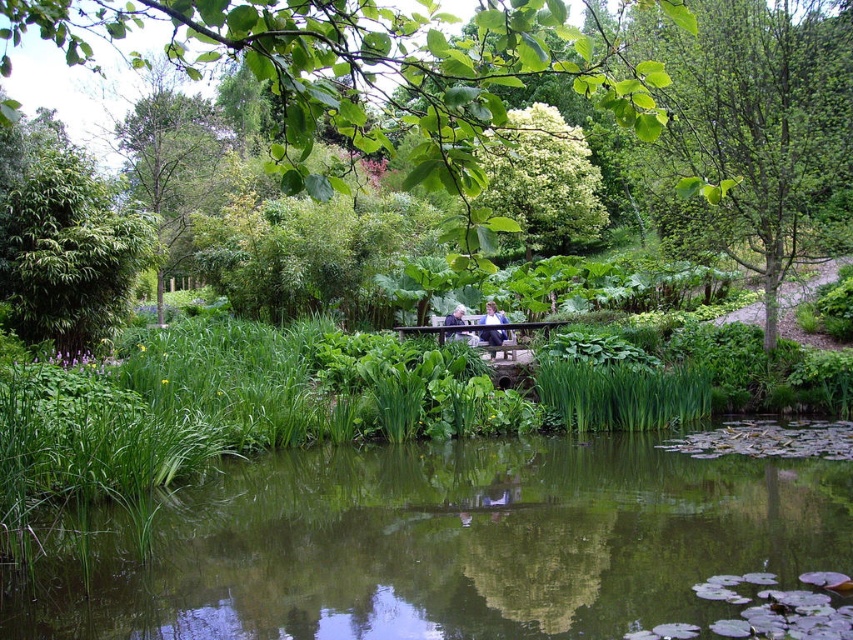
Who is shorter, green leafy tree at center or light blue fabric at center?

light blue fabric at center is shorter.

Is point (679, 99) positioned before point (451, 316)?

Yes, point (679, 99) is in front of point (451, 316).

Find the location of `green leafy tree at center`. green leafy tree at center is located at coordinates (757, 129).

Between green leafy tree at upper center and blue denim jacket at center, which one is positioned lower?

blue denim jacket at center is below.

Does point (538, 8) come closer to viewer compared to point (503, 339)?

That is True.

The image size is (853, 640). What are the coordinates of `green leafy tree at upper center` in the screenshot? It's located at (367, 72).

Who is more distant from viewer, (x=251, y=568) or (x=445, y=336)?

The point (x=445, y=336) is behind.

Does green reflective water at center appear under light blue fabric at center?

Yes, green reflective water at center is below light blue fabric at center.

Which is behind, point (532, 620) or point (445, 337)?

The point (445, 337) is more distant.

The width and height of the screenshot is (853, 640). I want to click on green reflective water at center, so click(x=466, y=547).